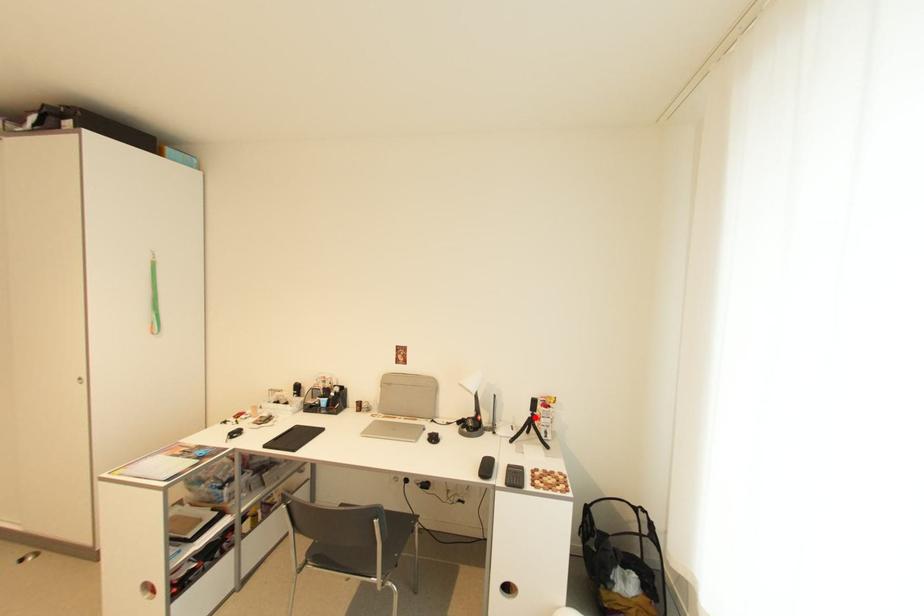
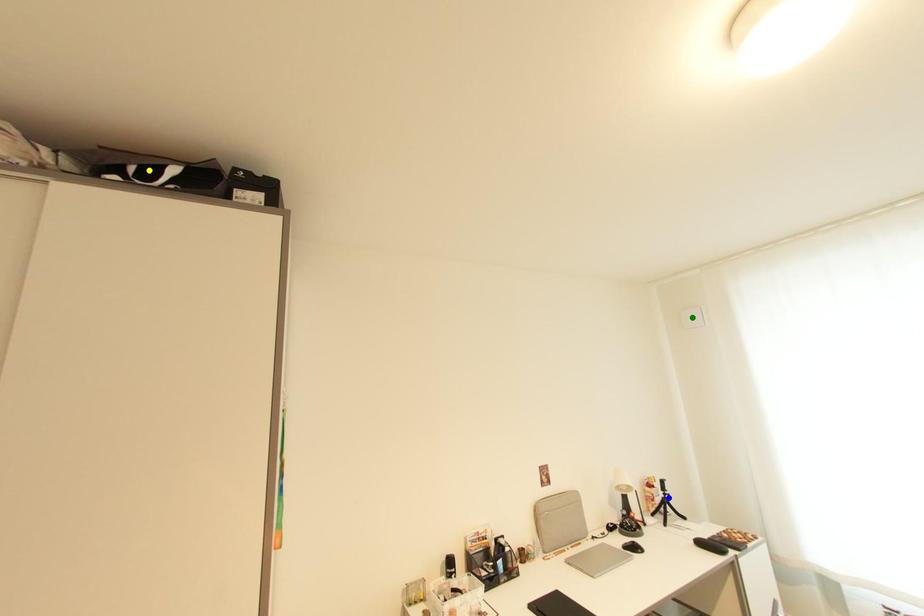
Question: I am providing you with two images of the same scene from different viewpoints. A red point is marked on the first image. You are given multiple points on the second image. Which spot in image 2 lines up with the point in image 1?

Choices:
 (A) green point
 (B) yellow point
 (C) blue point

Answer: (C)